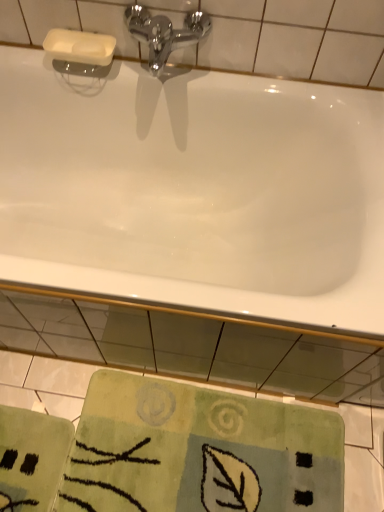
Image resolution: width=384 pixels, height=512 pixels. In order to click on blank area beneath chrome metallic faucet at upper center (from a real-world perspective) in this screenshot , I will do `click(165, 72)`.